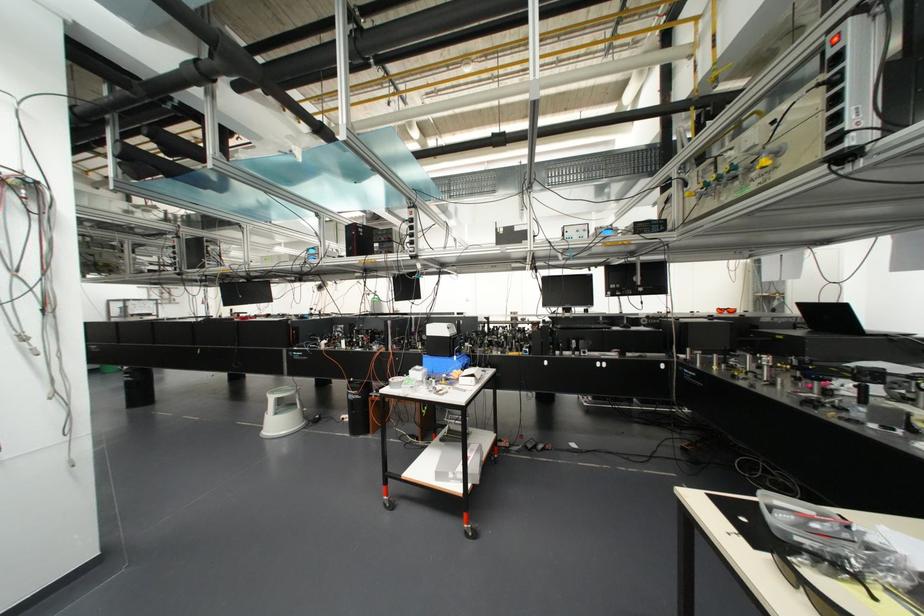
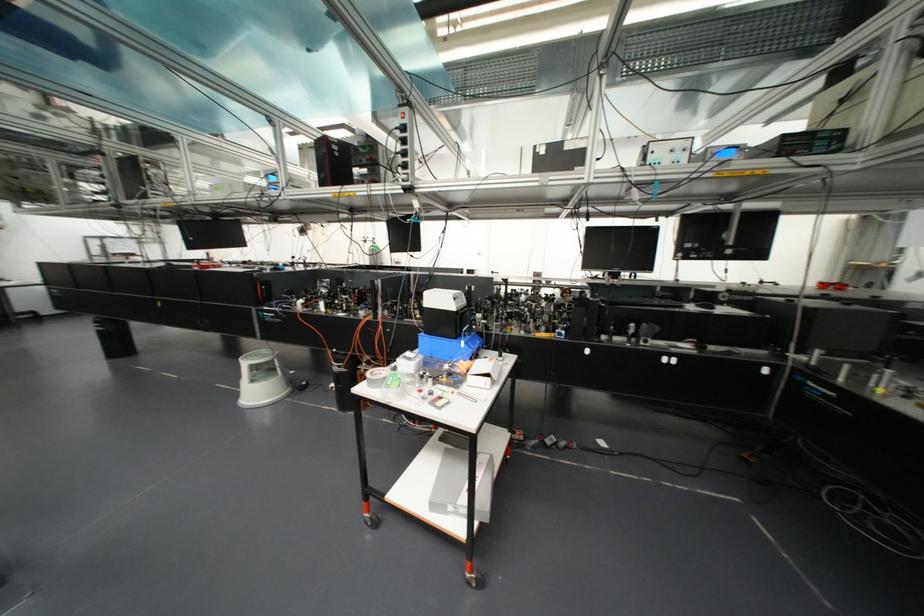
Find the pixel in the second image that matches (272,397) in the first image.

(244, 363)